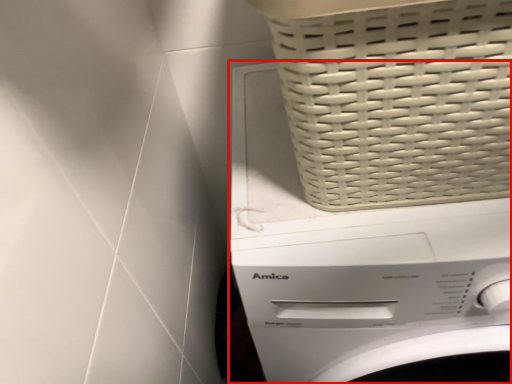
Question: Observing the image, what is the correct spatial positioning of washing machine (annotated by the red box) in reference to basket?

Choices:
 (A) left
 (B) right

Answer: (B)